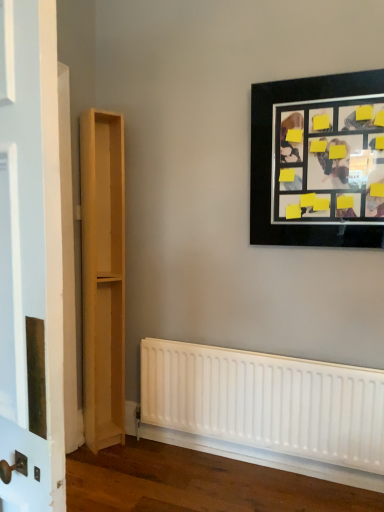
Find the location of a particular element. empty space that is to the right of light wood bookshelf at left is located at coordinates (129, 448).